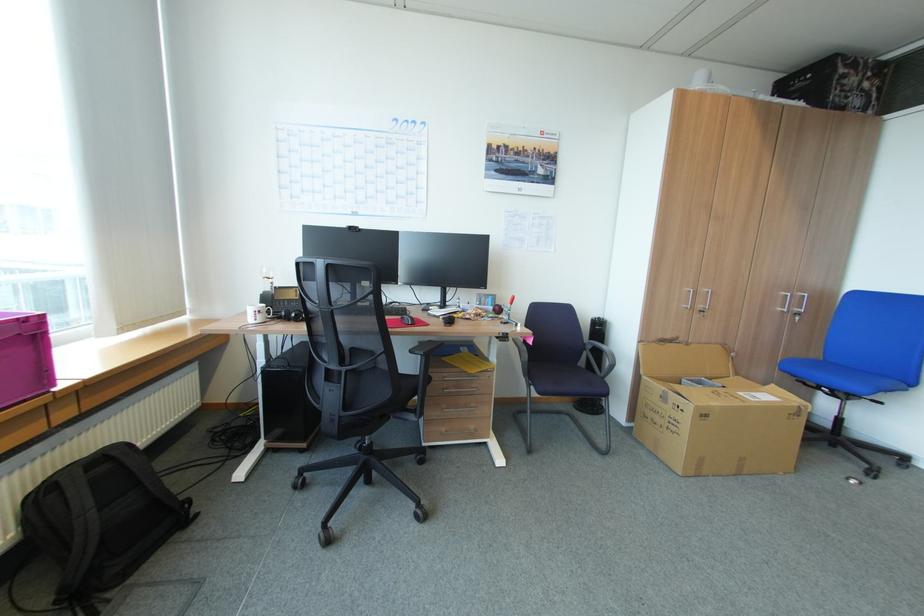
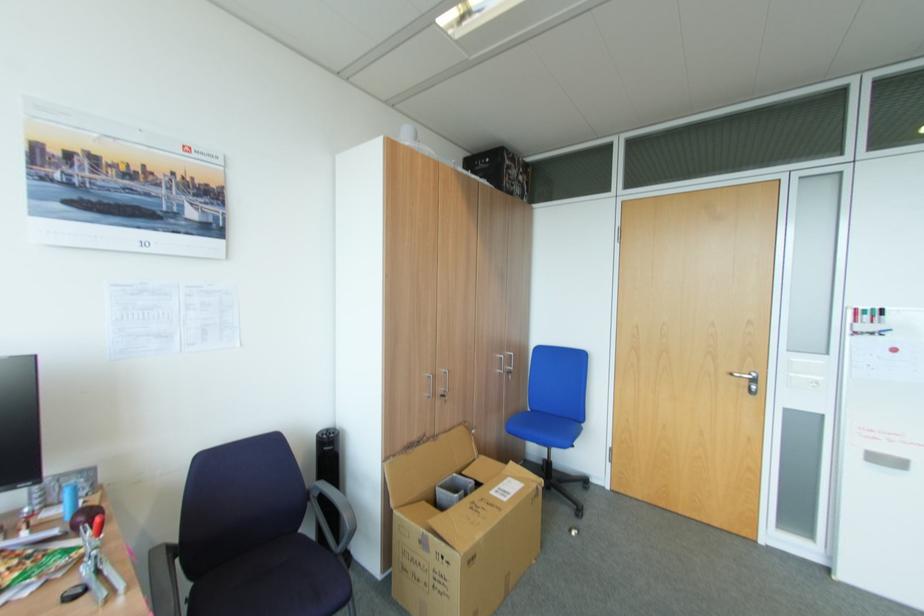
The point at (787,310) is marked in the first image. Where is the corresponding point in the second image?

(505, 371)